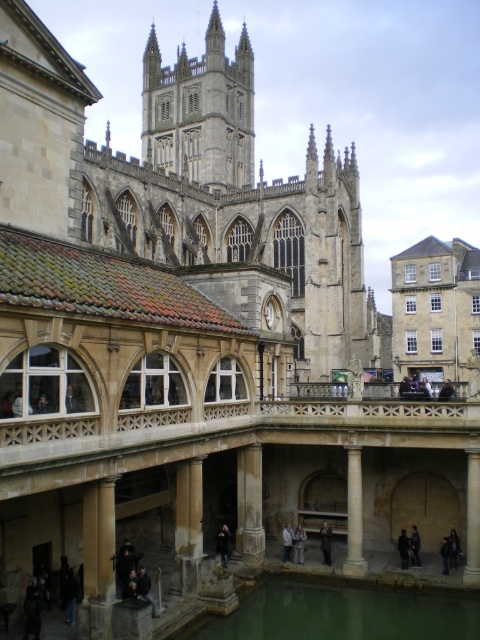
Question: Among these objects, which one is farthest from the camera?

Choices:
 (A) dark gray jacket at lower center
 (B) dark blue jacket at lower center

Answer: (A)

Question: Does dark blue jacket at center appear over dark brown leather jacket at lower center?

Choices:
 (A) no
 (B) yes

Answer: (B)

Question: Which point is closer to the camera taking this photo?

Choices:
 (A) (362, 573)
 (B) (408, 541)
 (C) (36, 600)

Answer: (C)

Question: Which point appears closest to the camera in this image?

Choices:
 (A) (238, 490)
 (B) (365, 566)
 (C) (227, 538)
 (D) (448, 548)

Answer: (B)

Question: Does green liquid water at lower center have a greater width compared to smooth stone pillar at center?

Choices:
 (A) no
 (B) yes

Answer: (B)

Question: Is the position of stone gothic tower at upper center less distant than that of dark gray fabric jacket at lower left?

Choices:
 (A) yes
 (B) no

Answer: (B)